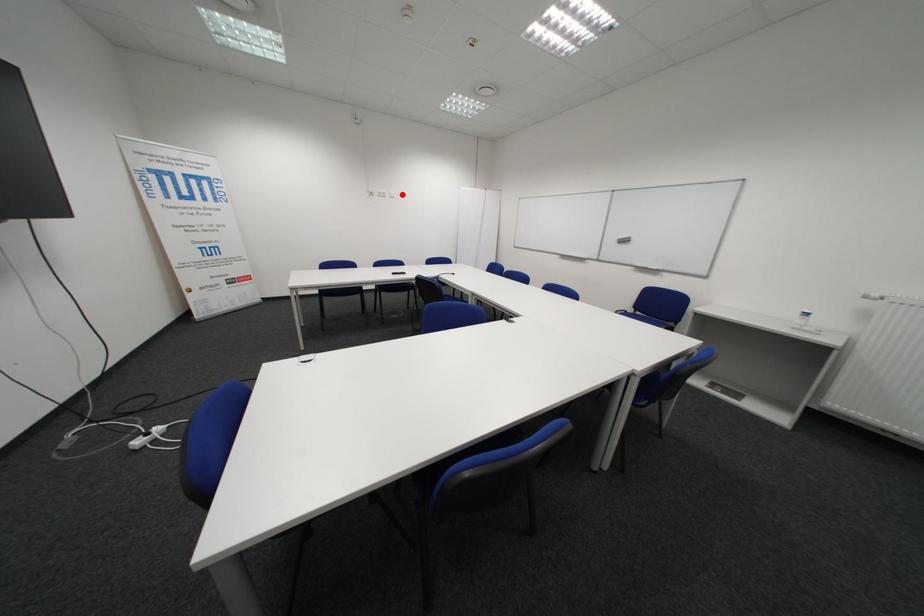
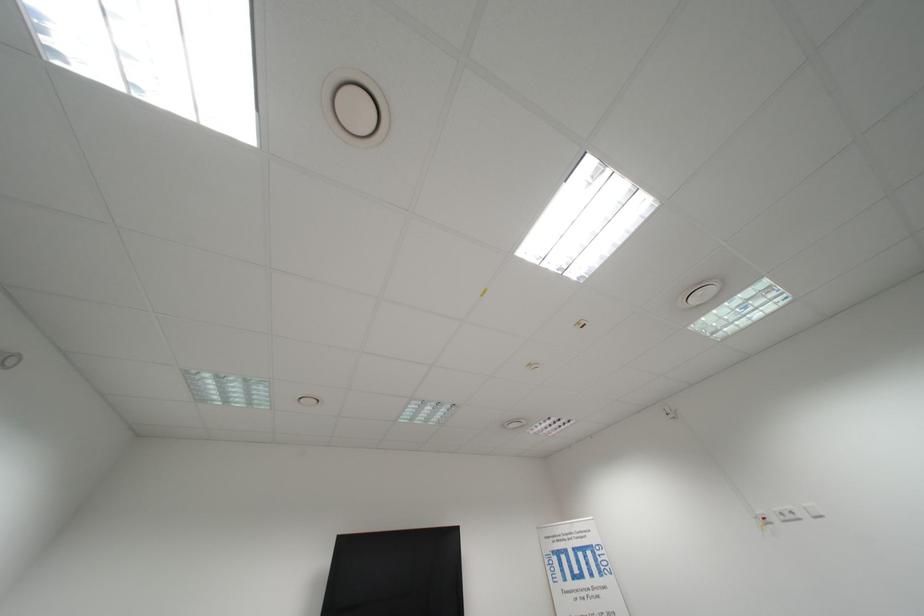
In the second image, find the point that corresponds to the highlighted location in the first image.

(818, 509)